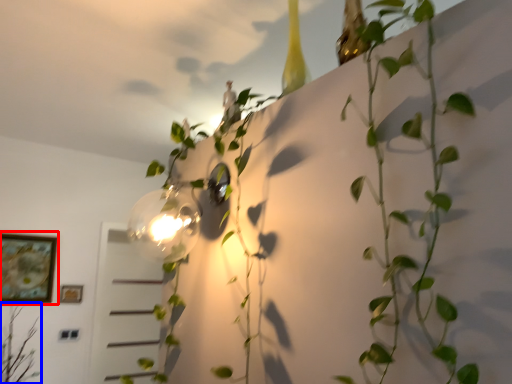
Question: Which of the following is the closest to the observer, picture frame (highlighted by a red box) or plant (highlighted by a blue box)?

Choices:
 (A) picture frame
 (B) plant

Answer: (B)